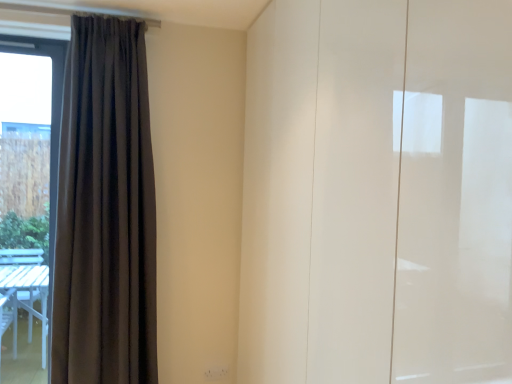
Question: Is there a large distance between dark grey fabric curtain at left and white glossy cabinet at right?

Choices:
 (A) no
 (B) yes

Answer: (B)

Question: Does dark grey fabric curtain at left have a greater height compared to white glossy cabinet at right?

Choices:
 (A) yes
 (B) no

Answer: (B)

Question: Is dark grey fabric curtain at left positioned in front of white glossy cabinet at right?

Choices:
 (A) no
 (B) yes

Answer: (A)

Question: Is dark grey fabric curtain at left thinner than white glossy cabinet at right?

Choices:
 (A) no
 (B) yes

Answer: (B)

Question: Is dark grey fabric curtain at left directly adjacent to white glossy cabinet at right?

Choices:
 (A) yes
 (B) no

Answer: (B)

Question: Considering the relative positions of dark grey fabric curtain at left and white glossy cabinet at right in the image provided, is dark grey fabric curtain at left to the left of white glossy cabinet at right from the viewer's perspective?

Choices:
 (A) yes
 (B) no

Answer: (A)

Question: Considering the relative sizes of white glossy cabinet at right and dark grey fabric curtain at left in the image provided, is white glossy cabinet at right smaller than dark grey fabric curtain at left?

Choices:
 (A) yes
 (B) no

Answer: (B)

Question: Is the position of white glossy cabinet at right less distant than that of dark grey fabric curtain at left?

Choices:
 (A) yes
 (B) no

Answer: (A)

Question: Does white glossy cabinet at right have a lesser width compared to dark grey fabric curtain at left?

Choices:
 (A) yes
 (B) no

Answer: (B)

Question: Can you confirm if white glossy cabinet at right is bigger than dark grey fabric curtain at left?

Choices:
 (A) no
 (B) yes

Answer: (B)

Question: Is white glossy cabinet at right positioned behind dark grey fabric curtain at left?

Choices:
 (A) no
 (B) yes

Answer: (A)

Question: Could dark grey fabric curtain at left be considered to be inside white glossy cabinet at right?

Choices:
 (A) yes
 (B) no

Answer: (B)

Question: Relative to dark grey fabric curtain at left, is white glossy cabinet at right in front or behind?

Choices:
 (A) behind
 (B) front

Answer: (B)